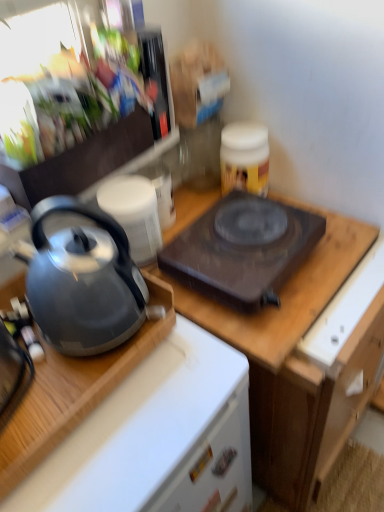
Question: Considering the relative positions of satin silver kettle at left and metallic silver kettle at upper left, the 1th appliance from the top, in the image provided, is satin silver kettle at left to the left of metallic silver kettle at upper left, the 1th appliance from the top, from the viewer's perspective?

Choices:
 (A) no
 (B) yes

Answer: (B)

Question: Does satin silver kettle at left have a greater width compared to metallic silver kettle at upper left, placed as the 2th appliance when sorted from bottom to top?

Choices:
 (A) yes
 (B) no

Answer: (A)

Question: Considering the relative sizes of satin silver kettle at left and metallic silver kettle at upper left, placed as the 2th appliance when sorted from bottom to top, in the image provided, is satin silver kettle at left smaller than metallic silver kettle at upper left, placed as the 2th appliance when sorted from bottom to top,?

Choices:
 (A) yes
 (B) no

Answer: (A)

Question: Are satin silver kettle at left and metallic silver kettle at upper left, the 1th appliance from the top, making contact?

Choices:
 (A) yes
 (B) no

Answer: (B)

Question: Does satin silver kettle at left have a lesser height compared to metallic silver kettle at upper left, the 1th appliance from the top?

Choices:
 (A) no
 (B) yes

Answer: (B)

Question: Is satin silver kettle at left not within metallic silver kettle at upper left, placed as the 2th appliance when sorted from bottom to top?

Choices:
 (A) yes
 (B) no

Answer: (A)

Question: Is wooden cutting board at center at the back of matte gray kettle at left?

Choices:
 (A) no
 (B) yes

Answer: (A)

Question: Is matte gray kettle at left positioned behind wooden cutting board at center?

Choices:
 (A) yes
 (B) no

Answer: (B)

Question: Is matte gray kettle at left positioned far away from wooden cutting board at center?

Choices:
 (A) no
 (B) yes

Answer: (A)

Question: From a real-world perspective, is matte gray kettle at left positioned under wooden cutting board at center based on gravity?

Choices:
 (A) yes
 (B) no

Answer: (B)

Question: Is matte gray kettle at left taller than wooden cutting board at center?

Choices:
 (A) yes
 (B) no

Answer: (A)

Question: From the image's perspective, is matte gray kettle at left under wooden cutting board at center?

Choices:
 (A) no
 (B) yes

Answer: (B)

Question: From the image's perspective, is satin silver kettle at left beneath white matte drawer at lower center?

Choices:
 (A) no
 (B) yes

Answer: (A)